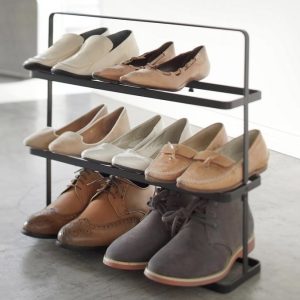
This screenshot has height=300, width=300. I want to click on shoes on the middle shelf, so click(44, 135), click(74, 138), click(104, 150), click(131, 156), click(160, 167), click(218, 183).